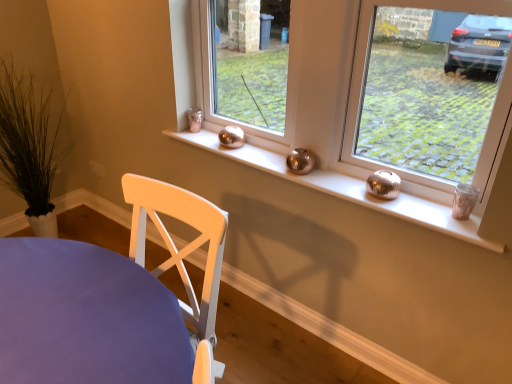
Question: From the image's perspective, is metallic silver vases at center, which is counted as the 2th window, starting from the left, above or below white painted wood chair at lower left?

Choices:
 (A) below
 (B) above

Answer: (B)

Question: Is metallic silver vases at center, which is counted as the 2th window, starting from the left, taller or shorter than white painted wood chair at lower left?

Choices:
 (A) short
 (B) tall

Answer: (A)

Question: Which object is positioned farthest from the white painted wood chair at lower left?

Choices:
 (A) metallic silver candle holder at right, the 3th window from the left
 (B) shiny metallic candle holder at right
 (C) metallic silver candle at center, which ranks as the first window in left-to-right order
 (D) metallic silver vases at center, the second window when ordered from right to left

Answer: (A)

Question: Considering the real-world distances, which object is farthest from the white painted wood chair at lower left?

Choices:
 (A) metallic silver candle holder at right, the 3th window from the left
 (B) metallic silver vases at center, which is counted as the 2th window, starting from the left
 (C) shiny metallic candle holder at right
 (D) metallic silver candle at center, the 3th window when ordered from right to left

Answer: (A)